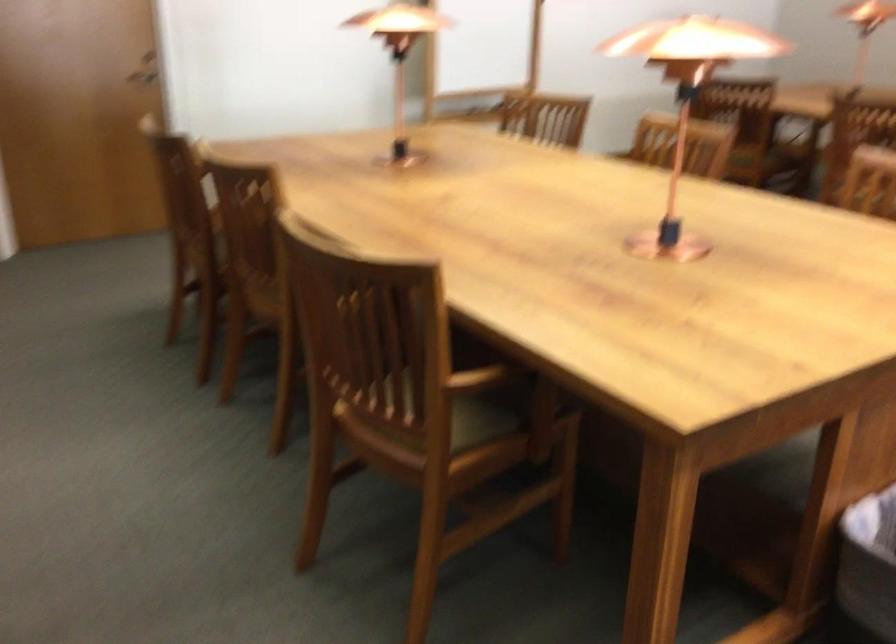
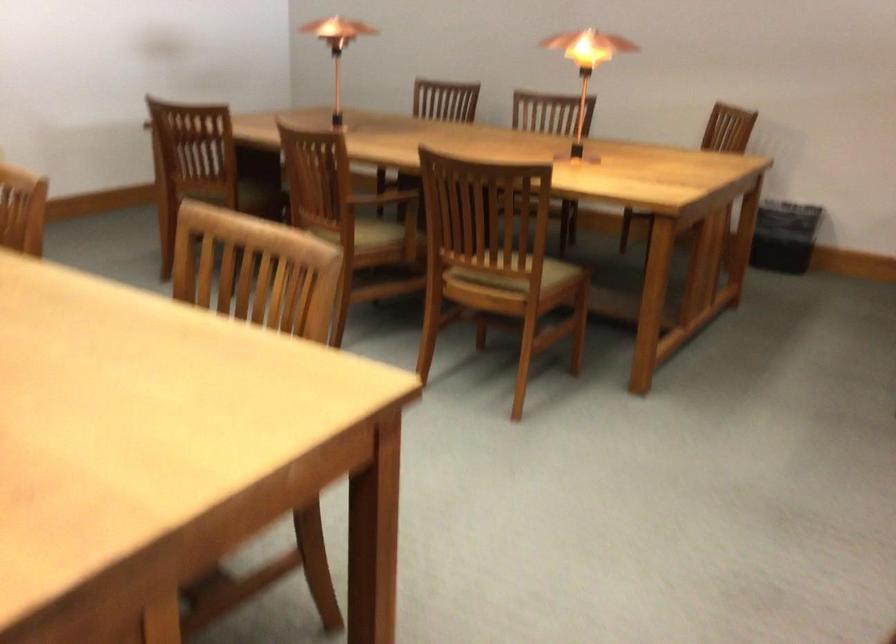
In a continuous first-person perspective shot, in which direction is the camera moving?

The cameraman moved toward right, forward.